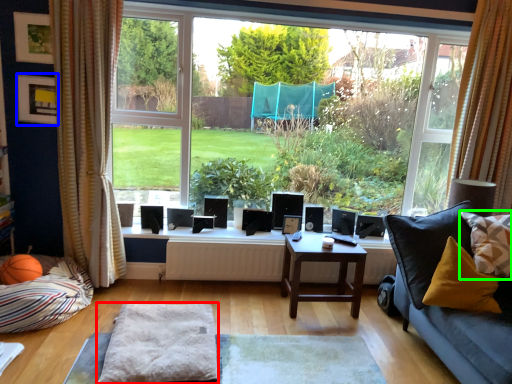
Question: Which is farther away from gray (highlighted by a red box)? picture frame (highlighted by a blue box) or pillow (highlighted by a green box)?

Choices:
 (A) picture frame
 (B) pillow

Answer: (B)